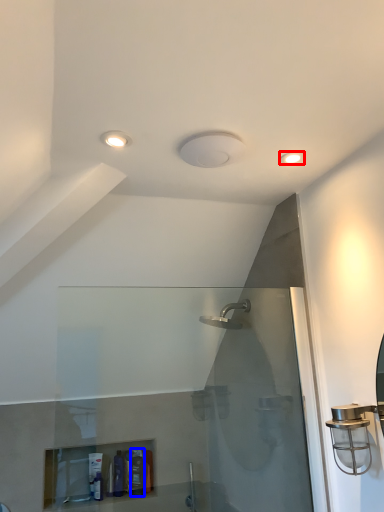
Question: Which object appears farthest to the camera in this image, light fixture (highlighted by a red box) or toiletry (highlighted by a blue box)?

Choices:
 (A) light fixture
 (B) toiletry

Answer: (B)